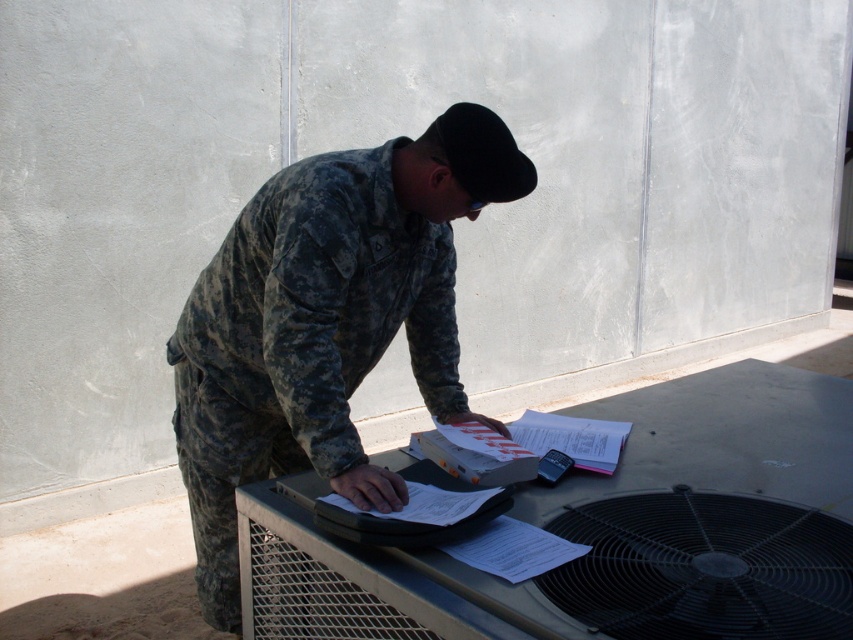
Who is positioned more to the right, camouflage uniform at center or black metallic mechanical fan at lower right?

From the viewer's perspective, black metallic mechanical fan at lower right appears more on the right side.

Can you confirm if camouflage uniform at center is positioned above black metallic mechanical fan at lower right?

Yes.

Find the location of a particular element. This screenshot has width=853, height=640. camouflage uniform at center is located at coordinates (326, 323).

Find the location of a particular element. This screenshot has width=853, height=640. camouflage uniform at center is located at coordinates (326, 323).